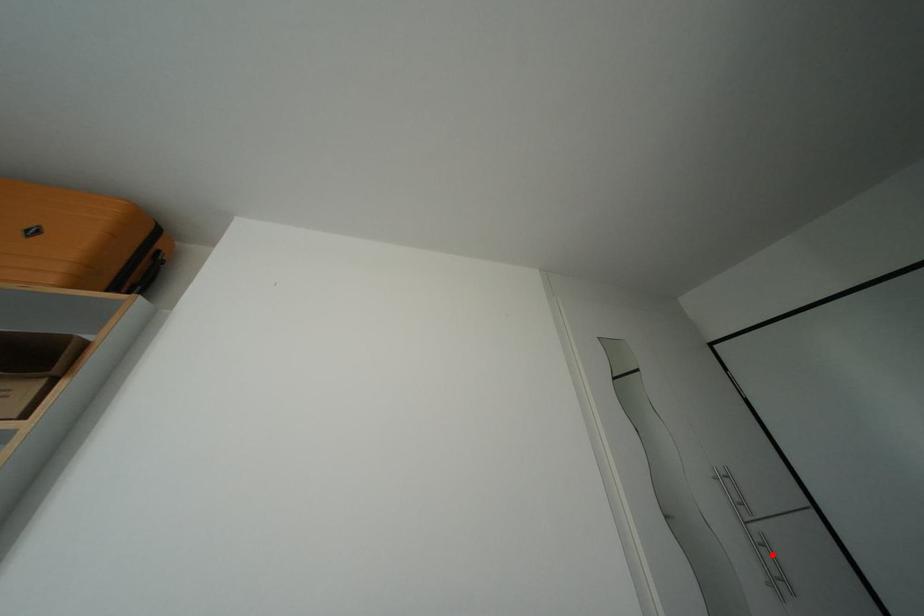
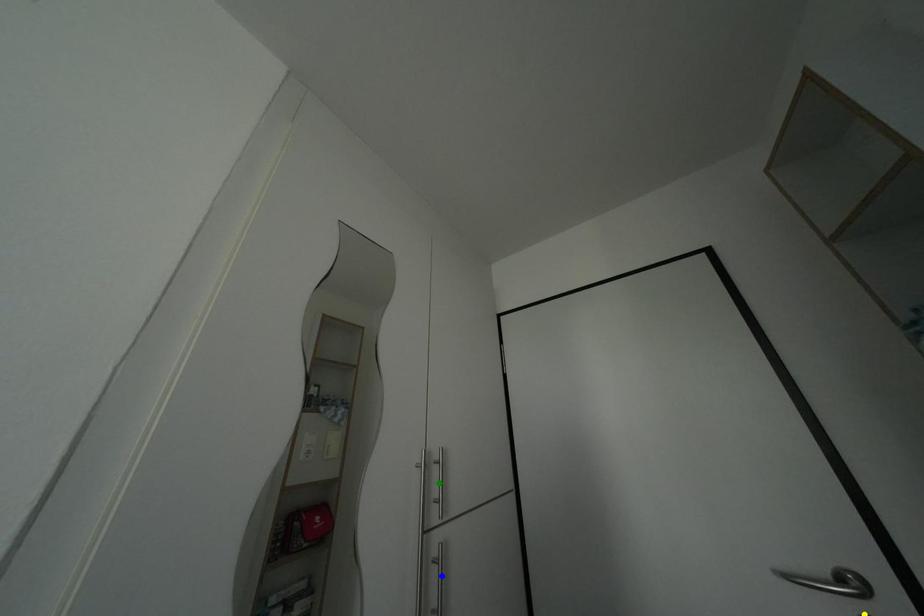
Question: I am providing you with two images of the same scene from different viewpoints. A red point is marked on the first image. You are given multiple points on the second image. Which spot in image 2 lines up with the point in image 1?

Choices:
 (A) blue point
 (B) yellow point
 (C) green point

Answer: (A)